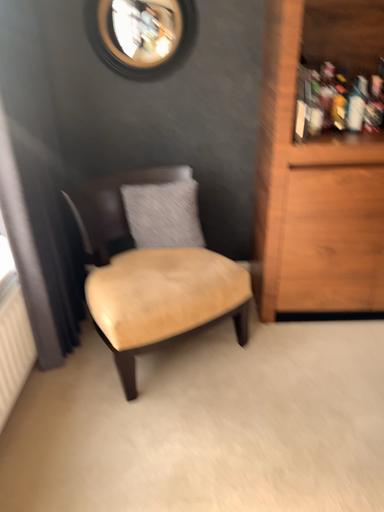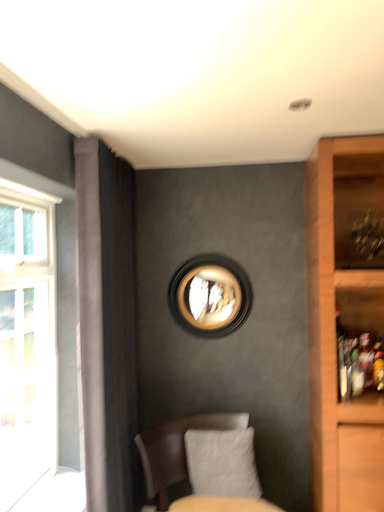
Question: How did the camera likely rotate when shooting the video?

Choices:
 (A) rotated upward
 (B) rotated downward

Answer: (A)